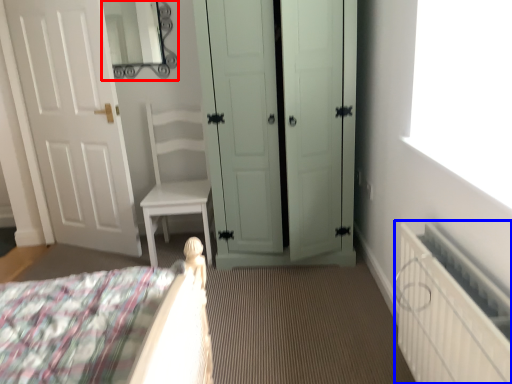
Question: Which point is further to the camera, mirror (highlighted by a red box) or radiator (highlighted by a blue box)?

Choices:
 (A) mirror
 (B) radiator

Answer: (A)